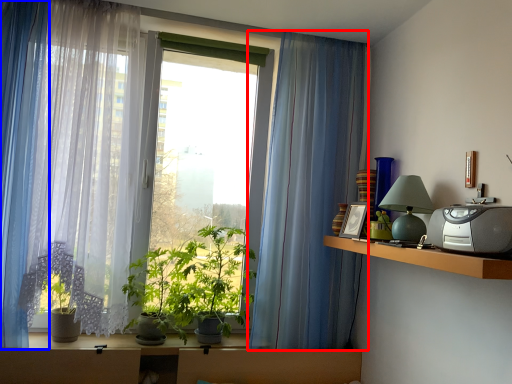
Question: Among these objects, which one is nearest to the camera, curtain (highlighted by a red box) or curtain (highlighted by a blue box)?

Choices:
 (A) curtain
 (B) curtain

Answer: (B)